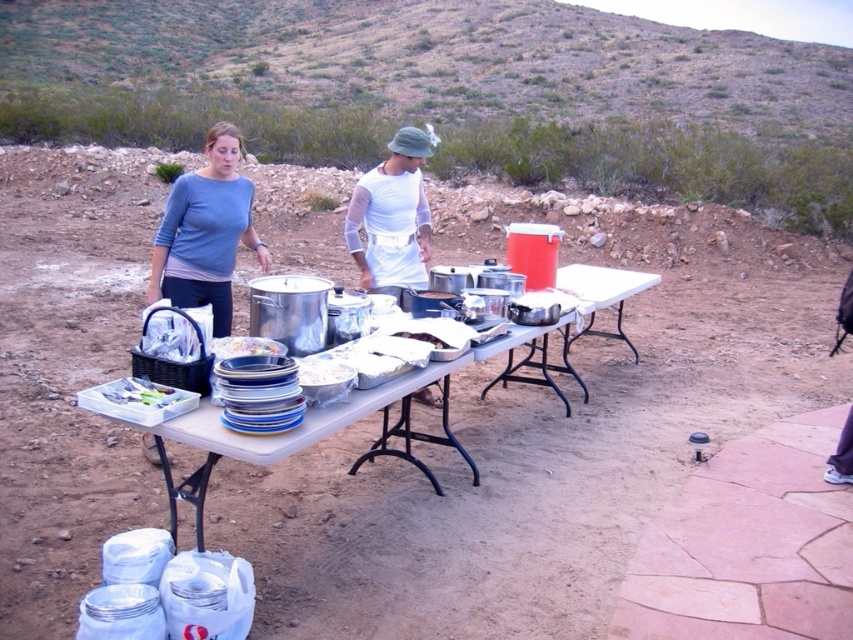
Question: Which point is closer to the camera taking this photo?

Choices:
 (A) (410, 333)
 (B) (107, 397)

Answer: (B)

Question: Can you confirm if white plastic table at center is positioned to the left of clear plastic container at lower left?

Choices:
 (A) yes
 (B) no

Answer: (B)

Question: Can you confirm if white plastic table at center is thinner than white plastic plate at center?

Choices:
 (A) no
 (B) yes

Answer: (A)

Question: Which point is farther from the camera taking this photo?

Choices:
 (A) (206, 285)
 (B) (396, 336)
 (C) (268, 412)
 (D) (173, 412)

Answer: (A)

Question: Which of the following is the farthest from the observer?

Choices:
 (A) metallic silver tray at center
 (B) white plastic plate at center
 (C) blue cotton shirt at upper left

Answer: (C)

Question: Can you confirm if blue cotton shirt at upper left is positioned to the left of metallic silver tray at center?

Choices:
 (A) yes
 (B) no

Answer: (A)